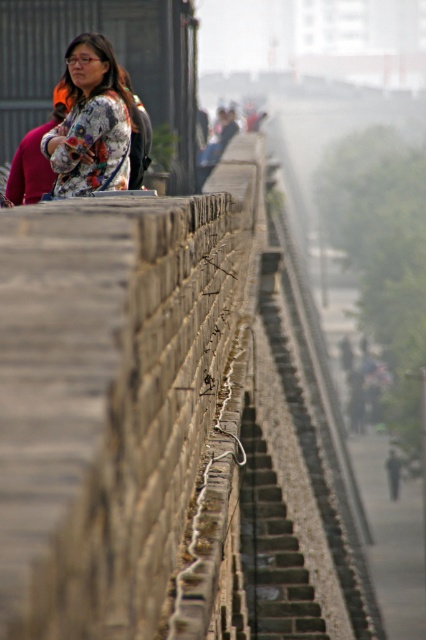
Is brown stone ledge at upper center closer to the viewer compared to dark gray stone stairs at center?

Yes, it is in front of dark gray stone stairs at center.

Can you confirm if brown stone ledge at upper center is thinner than dark gray stone stairs at center?

No.

Between point (103, 627) and point (301, 595), which one is positioned behind?

The point (301, 595) is behind.

I want to click on brown stone ledge at upper center, so 112,394.

Which is in front, point (149, 618) or point (94, 131)?

Positioned in front is point (149, 618).

Does brown stone ledge at upper center have a greater width compared to floral-patterned fabric at upper center?

Yes, brown stone ledge at upper center is wider than floral-patterned fabric at upper center.

Between point (54, 314) and point (72, 72), which one is positioned in front?

Point (54, 314)

Where is `brown stone ledge at upper center`? brown stone ledge at upper center is located at coordinates (112, 394).

Is dark gray stone stairs at center taller than floral-patterned fabric at upper center?

Correct, dark gray stone stairs at center is much taller as floral-patterned fabric at upper center.

Who is positioned more to the left, dark gray stone stairs at center or floral-patterned fabric at upper center?

floral-patterned fabric at upper center is more to the left.

Does point (284, 547) come closer to viewer compared to point (98, 157)?

That is False.

Locate an element on the screen. The height and width of the screenshot is (640, 426). dark gray stone stairs at center is located at coordinates pyautogui.click(x=271, y=548).